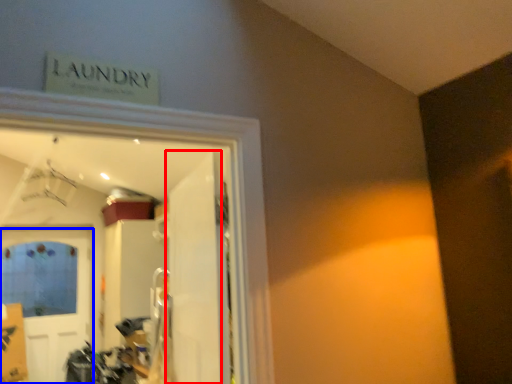
Question: Which object appears farthest to the camera in this image, door (highlighted by a red box) or door (highlighted by a blue box)?

Choices:
 (A) door
 (B) door

Answer: (B)